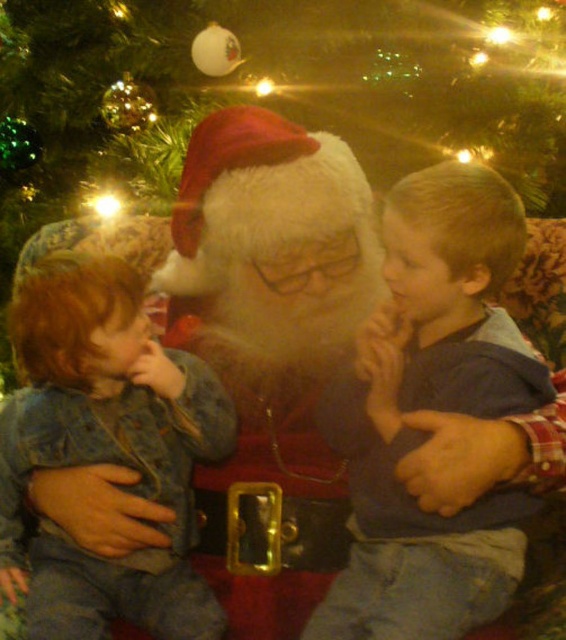
You are standing at the camera position and want to reach point (396,186). Can you estimate how far you need to walk to get there?

The distance between the camera and point (396,186) is 93.41 centimeters, so you need to walk approximately 93.41 centimeters to reach it.

You are standing in the room and want to take a photo of the two points mentioned. Which point, point (405, 605) or point (53, 524), will appear larger in your photo?

Point (405, 605) is closer to the camera than point (53, 524), so it will appear larger in the photo.